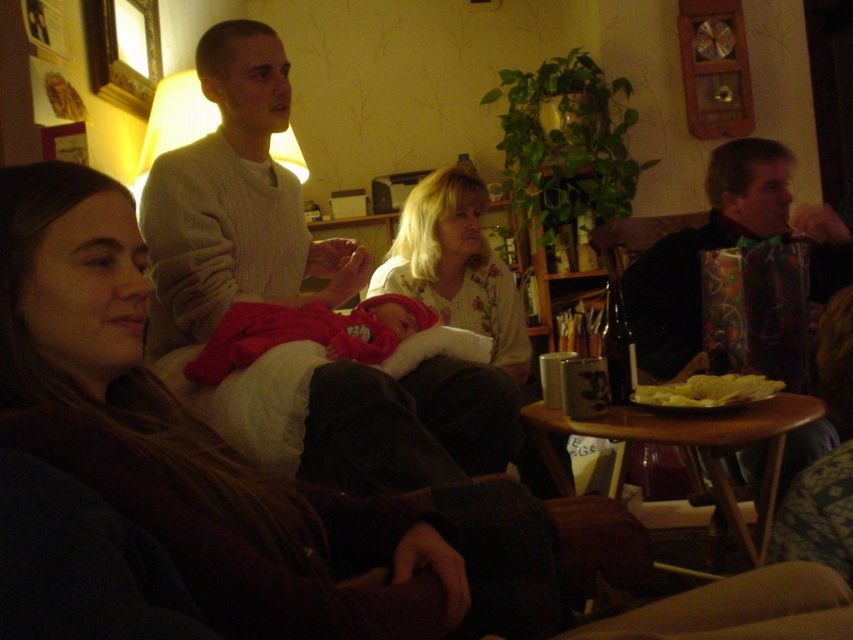
Question: Is floral fabric shirt at center further to the viewer compared to golden crispy chips at table center?

Choices:
 (A) yes
 (B) no

Answer: (A)

Question: Does matte black shirt at right appear on the left side of golden crispy chips at table center?

Choices:
 (A) no
 (B) yes

Answer: (A)

Question: Which point appears closest to the camera in this image?

Choices:
 (A) (691, 348)
 (B) (676, 397)
 (C) (207, 42)

Answer: (B)

Question: Which of these objects is positioned farthest from the matte black shirt at right?

Choices:
 (A) golden crispy chips at table center
 (B) light beige sweater at center
 (C) floral fabric shirt at center

Answer: (B)

Question: Which object is the farthest from the golden crispy chips at table center?

Choices:
 (A) light beige sweater at center
 (B) floral fabric shirt at center

Answer: (A)

Question: Is matte black shirt at right smaller than golden crispy chips at table center?

Choices:
 (A) yes
 (B) no

Answer: (B)